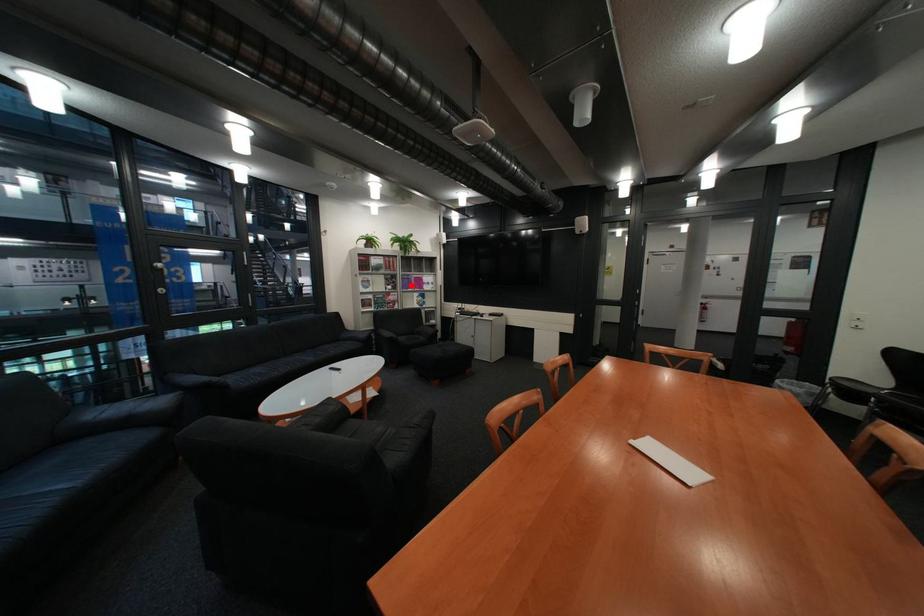
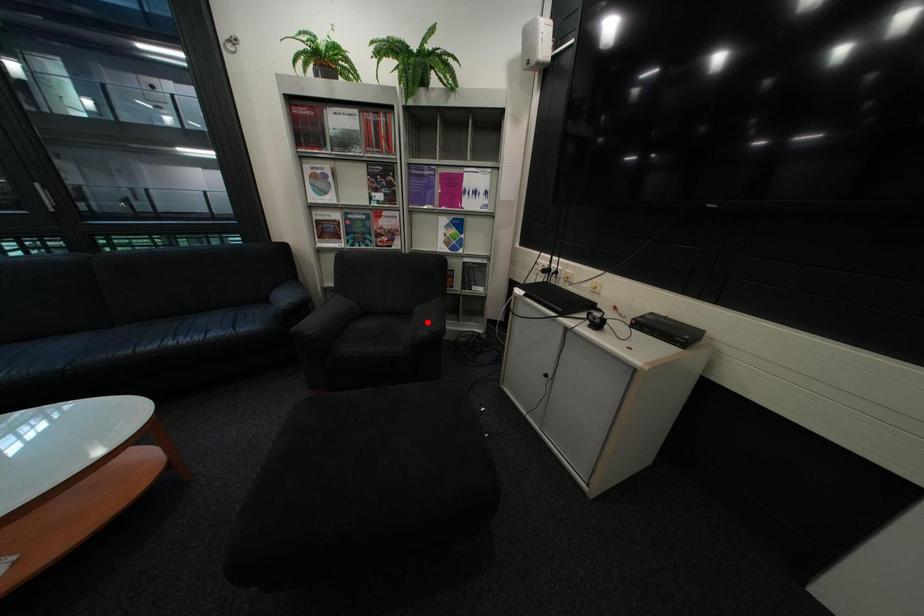
I am providing you with two images of the same scene from different viewpoints. A red point is marked on the first image and another point is marked on the second image. Does the point marked in image1 correspond to the same location as the one in image2?

No